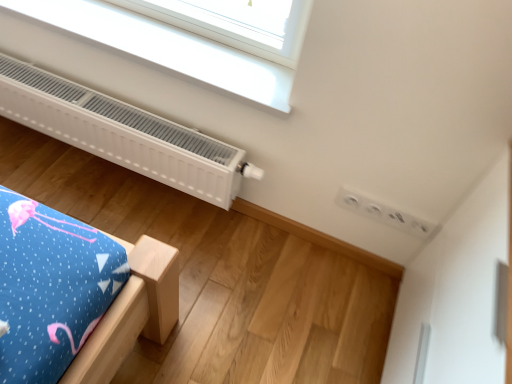
Question: Do you think white matte radiator at upper left is within white plastic window at upper center, or outside of it?

Choices:
 (A) inside
 (B) outside

Answer: (B)

Question: Considering the positions of white matte radiator at upper left and white plastic window at upper center in the image, is white matte radiator at upper left taller or shorter than white plastic window at upper center?

Choices:
 (A) short
 (B) tall

Answer: (B)

Question: Would you say white matte radiator at upper left is to the left or to the right of white plastic window at upper center in the picture?

Choices:
 (A) left
 (B) right

Answer: (A)

Question: Relative to white matte radiator at upper left, is white plastic window at upper center in front or behind?

Choices:
 (A) front
 (B) behind

Answer: (A)

Question: From their relative heights in the image, would you say white plastic window at upper center is taller or shorter than white matte radiator at upper left?

Choices:
 (A) short
 (B) tall

Answer: (A)

Question: Is point (164, 46) closer or farther from the camera than point (93, 137)?

Choices:
 (A) farther
 (B) closer

Answer: (B)

Question: Would you say white plastic window at upper center is to the left or to the right of white matte radiator at upper left in the picture?

Choices:
 (A) right
 (B) left

Answer: (A)